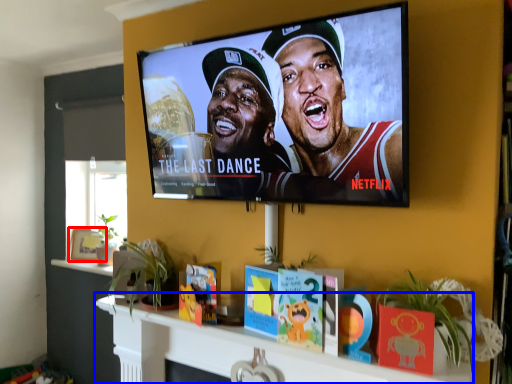
Question: Which of the following is the closest to the observer, picture frame (highlighted by a red box) or shelf (highlighted by a blue box)?

Choices:
 (A) picture frame
 (B) shelf

Answer: (B)